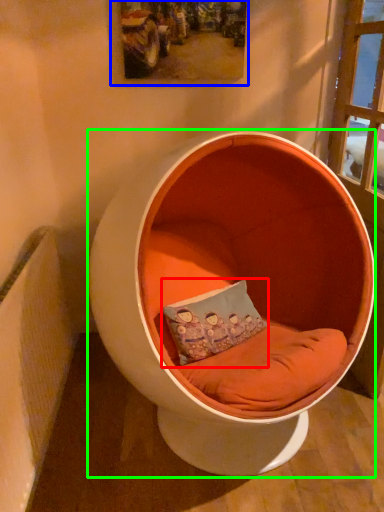
Question: Based on their relative distances, which object is farther from pillow (highlighted by a red box)? Choose from picture frame (highlighted by a blue box) and furniture (highlighted by a green box).

Choices:
 (A) picture frame
 (B) furniture

Answer: (A)